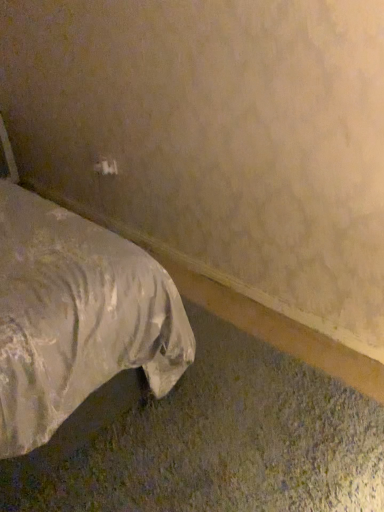
Question: Should I look upward or downward to see white satin bed at lower left?

Choices:
 (A) down
 (B) up

Answer: (B)

Question: From a real-world perspective, is white plastic electric outlet at upper center on white satin bed at lower left?

Choices:
 (A) no
 (B) yes

Answer: (A)

Question: From the image's perspective, does white plastic electric outlet at upper center appear lower than white satin bed at lower left?

Choices:
 (A) yes
 (B) no

Answer: (B)

Question: Is white plastic electric outlet at upper center wider than white satin bed at lower left?

Choices:
 (A) no
 (B) yes

Answer: (A)

Question: Is white satin bed at lower left inside white plastic electric outlet at upper center?

Choices:
 (A) yes
 (B) no

Answer: (B)

Question: Does white plastic electric outlet at upper center appear on the right side of white satin bed at lower left?

Choices:
 (A) yes
 (B) no

Answer: (A)

Question: Is white plastic electric outlet at upper center further to the viewer compared to white satin bed at lower left?

Choices:
 (A) no
 (B) yes

Answer: (B)

Question: From a real-world perspective, does white satin bed at lower left sit lower than white plastic electric outlet at upper center?

Choices:
 (A) no
 (B) yes

Answer: (A)

Question: Is white satin bed at lower left not within white plastic electric outlet at upper center?

Choices:
 (A) yes
 (B) no

Answer: (A)

Question: Is white satin bed at lower left not near white plastic electric outlet at upper center?

Choices:
 (A) no
 (B) yes

Answer: (B)

Question: Is white satin bed at lower left facing towards white plastic electric outlet at upper center?

Choices:
 (A) no
 (B) yes

Answer: (A)

Question: From a real-world perspective, is white satin bed at lower left on white plastic electric outlet at upper center?

Choices:
 (A) yes
 (B) no

Answer: (A)

Question: Does white satin bed at lower left contain white plastic electric outlet at upper center?

Choices:
 (A) yes
 (B) no

Answer: (B)

Question: From a real-world perspective, is white plastic electric outlet at upper center physically located above or below white satin bed at lower left?

Choices:
 (A) below
 (B) above

Answer: (A)